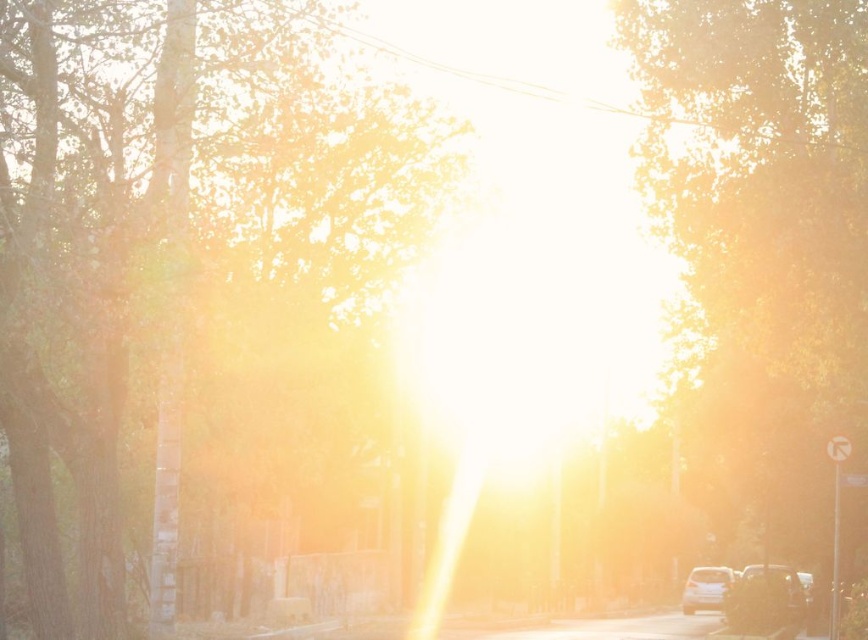
You are a pedestrian standing on the street and want to cross to the other side. There are two cars in your view, the smokey black car at lower right and the satin white car at lower right. Which car is nearer to you?

The smokey black car at lower right is closer to the viewer than the satin white car at lower right.

You are standing on the street in the image and want to walk from point (827, 452) to point (765, 595). Which direction should you face to move towards the closer point?

Point (765, 595) is further to the camera than point (827, 452). To move towards the closer point, you should face away from the camera direction since point (827, 452) is nearer.

You are driving a smokey black car at lower right and want to park it near the white plastic street sign at center. Given that the parking space is 15 feet long, will the car fit? Please explain your reasoning.

The smokey black car at lower right is 18.01 feet away from the white plastic street sign at center. Since the parking space is only 15 feet long, the car will not fit as it requires more space than available.